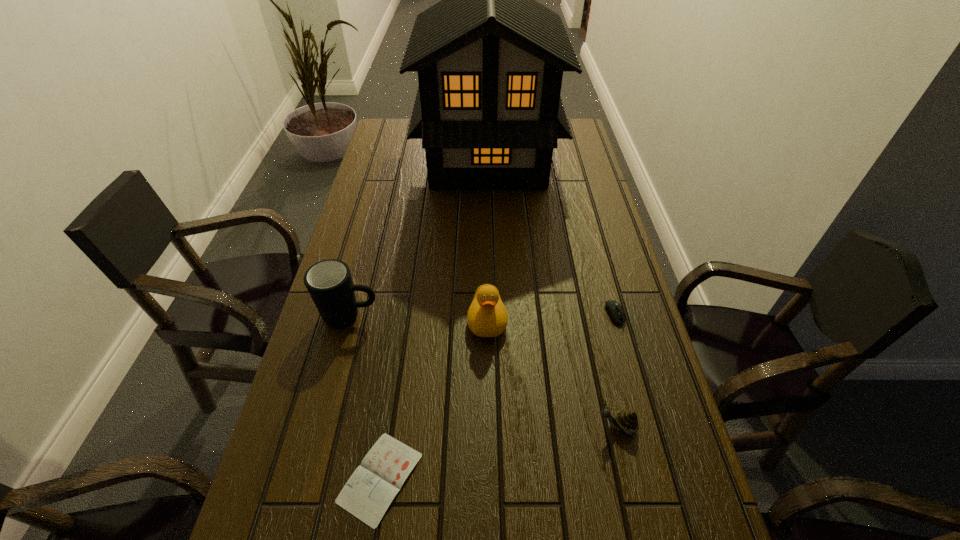
At what (x,y) coordinates should I click in order to perform the action: click on unoccupied area between the diary and the second tallest object. Please return your answer as a coordinate pair (x, y). The height and width of the screenshot is (540, 960). Looking at the image, I should click on (366, 397).

At what (x,y) coordinates should I click in order to perform the action: click on free point between the diary and the fourth shortest object. Please return your answer as a coordinate pair (x, y). The image size is (960, 540). Looking at the image, I should click on point(434,399).

Find the location of a particular element. This screenshot has width=960, height=540. free space between the tallest object and the duck is located at coordinates (488, 239).

This screenshot has width=960, height=540. I want to click on vacant space that is in between the snail and the third tallest object, so click(552, 373).

Where is `free space between the computer mouse and the shortest object`? free space between the computer mouse and the shortest object is located at coordinates (497, 397).

Image resolution: width=960 pixels, height=540 pixels. Find the location of `object that is the third closest to the diary`. object that is the third closest to the diary is located at coordinates (627, 421).

The width and height of the screenshot is (960, 540). I want to click on object that is the fourth nearest to the computer mouse, so click(370, 490).

What are the coordinates of `free spot that satisfies the following two spatial constraints: 1. on the side of the shortest object with the handle; 2. on the left side of the second tallest object` in the screenshot? It's located at (308, 478).

The image size is (960, 540). What are the coordinates of `vacant area in the image that satisfies the following two spatial constraints: 1. on the front-facing side of the tallest object; 2. on the face of the duck` in the screenshot? It's located at (492, 320).

Where is `vacant area that satisfies the following two spatial constraints: 1. on the face of the fourth tallest object; 2. on the front side of the diary`? The height and width of the screenshot is (540, 960). vacant area that satisfies the following two spatial constraints: 1. on the face of the fourth tallest object; 2. on the front side of the diary is located at coordinates (629, 478).